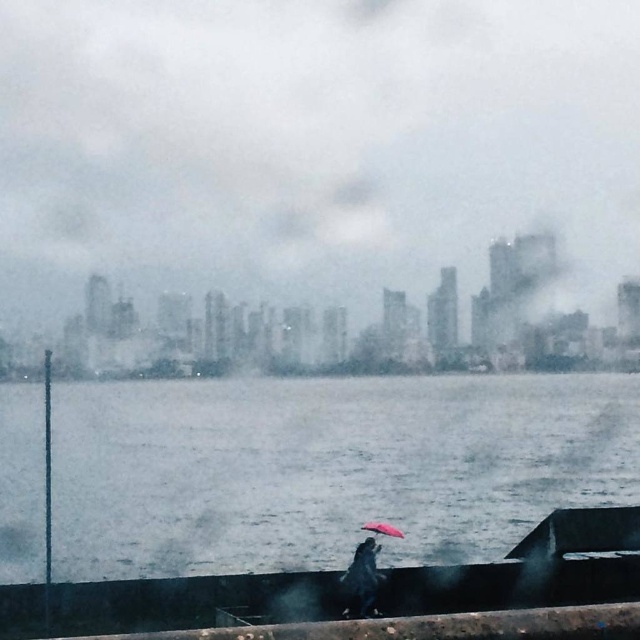
You are standing at the point with coordinates point (394,528) and want to walk towards the point (144,547). Given that the path between them is clear, will you be moving towards or away from the person holding the bright red umbrella?

Point (144,547) is in front of point (394,528), so moving towards point (144,547) would mean moving towards the person holding the bright red umbrella.

You are navigating a small boat in the harbor and need to pass between the two points, point (193,259) and point (372,529). Which point should you approach first to stay on course?

You should approach point (372,529) first because point (193,259) is behind it, meaning point (372,529) is closer to your current position.

You are a photographer trying to capture both the shiny black umbrella at lower center and the matte pink umbrella at center in a single shot. Based on their positions, which umbrella will appear larger in the photo?

The shiny black umbrella at lower center will appear larger in the photo because it is closer to the camera than the matte pink umbrella at center.